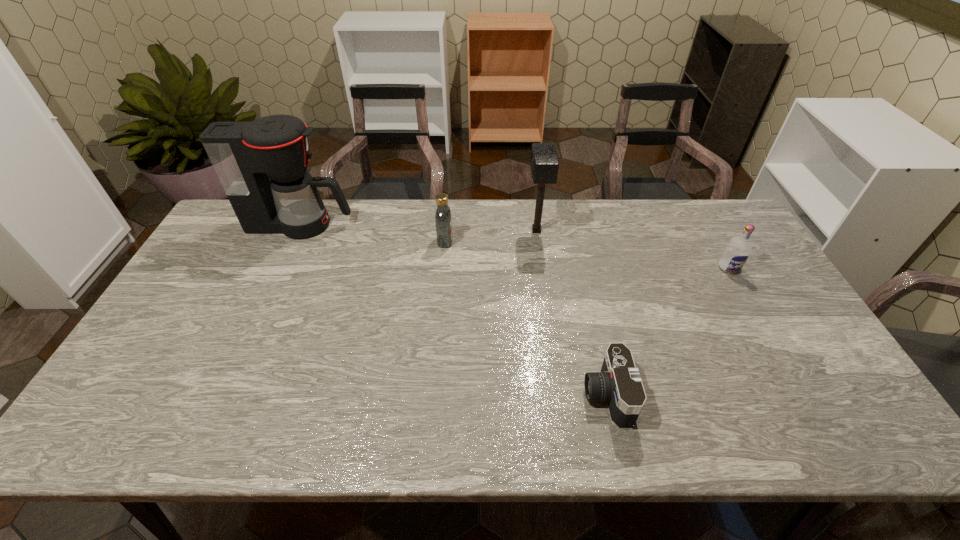
The height and width of the screenshot is (540, 960). In order to click on coffee maker in this screenshot , I will do [x=262, y=165].

Where is `the tallest object`? This screenshot has width=960, height=540. the tallest object is located at coordinates (262, 165).

Find the location of `the third object from left to right`. the third object from left to right is located at coordinates (544, 163).

Find the location of `the second tallest object`. the second tallest object is located at coordinates (544, 163).

The height and width of the screenshot is (540, 960). I want to click on the fourth object from right to left, so click(443, 220).

You are a GUI agent. You are given a task and a screenshot of the screen. Output one action in this format:
    pyautogui.click(x=<x>, y=<y>)
    Task: Click on the left vodka
    
    Given the screenshot: What is the action you would take?
    pyautogui.click(x=443, y=220)

Locate an element on the screen. The width and height of the screenshot is (960, 540). the rightmost object is located at coordinates (738, 249).

Locate an element on the screen. Image resolution: width=960 pixels, height=540 pixels. the nearer vodka is located at coordinates (738, 249).

The height and width of the screenshot is (540, 960). Find the location of `the shortest object`. the shortest object is located at coordinates (618, 383).

You are a GUI agent. You are given a task and a screenshot of the screen. Output one action in this format:
    pyautogui.click(x=<x>, y=<y>)
    Task: Click on the fourth object from left to right
    The width and height of the screenshot is (960, 540).
    Given the screenshot: What is the action you would take?
    pyautogui.click(x=618, y=383)